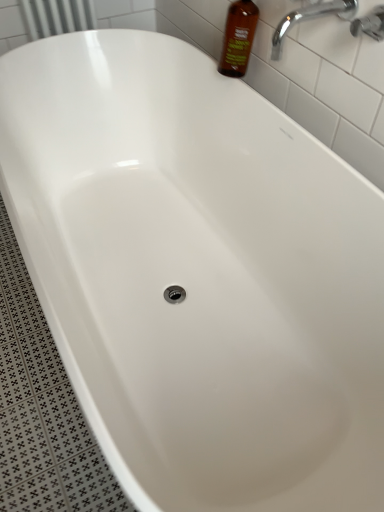
Identify the location of chrome metallic faucet at upper right. Image resolution: width=384 pixels, height=512 pixels. (370, 24).

The image size is (384, 512). Find the location of `chrome metallic faucet at upper right`. chrome metallic faucet at upper right is located at coordinates (370, 24).

Considering the relative positions of chrome metallic faucet at upper right and brown glass bottle at upper right in the image provided, is chrome metallic faucet at upper right to the left of brown glass bottle at upper right from the viewer's perspective?

No.

Measure the distance from chrome metallic faucet at upper right to brown glass bottle at upper right.

A distance of 15.78 inches exists between chrome metallic faucet at upper right and brown glass bottle at upper right.

Which point is more forward, (364, 24) or (245, 59)?

The point (364, 24) is closer.

From the image's perspective, who appears lower, chrome metallic faucet at upper right or brown glass bottle at upper right?

chrome metallic faucet at upper right.

Between point (243, 38) and point (376, 31), which one is positioned in front?

The point (376, 31) is more forward.

Where is `bottle that is above the chrome metallic faucet at upper right (from the image's perspective)`? Image resolution: width=384 pixels, height=512 pixels. bottle that is above the chrome metallic faucet at upper right (from the image's perspective) is located at coordinates (238, 38).

Is brown glass bottle at upper right oriented towards chrome metallic faucet at upper right?

No.

Based on the photo, is brown glass bottle at upper right not inside chrome metallic faucet at upper right?

Absolutely, brown glass bottle at upper right is external to chrome metallic faucet at upper right.

Who is taller, chrome metallic faucet at upper right or chrome metallic faucet at upper right?

With more height is chrome metallic faucet at upper right.

Considering the sizes of objects chrome metallic faucet at upper right and chrome metallic faucet at upper right in the image provided, who is thinner, chrome metallic faucet at upper right or chrome metallic faucet at upper right?

Thinner between the two is chrome metallic faucet at upper right.

Measure the distance from chrome metallic faucet at upper right to chrome metallic faucet at upper right.

chrome metallic faucet at upper right and chrome metallic faucet at upper right are 5.34 inches apart from each other.

Based on the photo, can we say chrome metallic faucet at upper right lies outside chrome metallic faucet at upper right?

chrome metallic faucet at upper right lies outside chrome metallic faucet at upper right's area.

Between brown glass bottle at upper right and chrome metallic faucet at upper right, which one has more height?

With more height is brown glass bottle at upper right.

From a real-world perspective, is brown glass bottle at upper right over chrome metallic faucet at upper right?

Actually, brown glass bottle at upper right is physically below chrome metallic faucet at upper right in the real world.

Considering the points (225, 67) and (355, 12), which point is in front, point (225, 67) or point (355, 12)?

Point (355, 12)

Looking at their sizes, would you say brown glass bottle at upper right is wider or thinner than chrome metallic faucet at upper right?

brown glass bottle at upper right is thinner than chrome metallic faucet at upper right.

What's the angular difference between chrome metallic faucet at upper right and chrome metallic faucet at upper right's facing directions?

chrome metallic faucet at upper right and chrome metallic faucet at upper right are facing 0.00544 degrees away from each other.

Which of these two, chrome metallic faucet at upper right or chrome metallic faucet at upper right, is smaller?

chrome metallic faucet at upper right is smaller.

Between chrome metallic faucet at upper right and chrome metallic faucet at upper right, which one has larger width?

Wider between the two is chrome metallic faucet at upper right.

Is chrome metallic faucet at upper right facing towards chrome metallic faucet at upper right?

No, chrome metallic faucet at upper right is not turned towards chrome metallic faucet at upper right.

From the image's perspective, does chrome metallic faucet at upper right appear higher than brown glass bottle at upper right?

Actually, chrome metallic faucet at upper right appears below brown glass bottle at upper right in the image.

From a real-world perspective, is chrome metallic faucet at upper right beneath brown glass bottle at upper right?

Incorrect, from a real-world perspective, chrome metallic faucet at upper right is higher than brown glass bottle at upper right.

Does chrome metallic faucet at upper right have a lesser width compared to brown glass bottle at upper right?

No, chrome metallic faucet at upper right is not thinner than brown glass bottle at upper right.

Considering the sizes of objects chrome metallic faucet at upper right and brown glass bottle at upper right in the image provided, who is smaller, chrome metallic faucet at upper right or brown glass bottle at upper right?

With smaller size is chrome metallic faucet at upper right.

Identify the location of bottle behind the chrome metallic faucet at upper right. (238, 38).

The image size is (384, 512). Identify the location of bottle above the chrome metallic faucet at upper right (from the image's perspective). (238, 38).

When comparing their distances from chrome metallic faucet at upper right, does chrome metallic faucet at upper right or brown glass bottle at upper right seem further?

Based on the image, brown glass bottle at upper right appears to be further to chrome metallic faucet at upper right.

Based on the photo, when comparing their distances from brown glass bottle at upper right, does chrome metallic faucet at upper right or chrome metallic faucet at upper right seem further?

chrome metallic faucet at upper right lies further to brown glass bottle at upper right than the other object.

Considering their positions, is chrome metallic faucet at upper right positioned closer to chrome metallic faucet at upper right than brown glass bottle at upper right?

Based on the image, chrome metallic faucet at upper right appears to be nearer to chrome metallic faucet at upper right.

Based on their spatial positions, is brown glass bottle at upper right or chrome metallic faucet at upper right further from chrome metallic faucet at upper right?

brown glass bottle at upper right lies further to chrome metallic faucet at upper right than the other object.

Looking at the image, which one is located closer to brown glass bottle at upper right, chrome metallic faucet at upper right or chrome metallic faucet at upper right?

Among the two, chrome metallic faucet at upper right is located nearer to brown glass bottle at upper right.

Based on their spatial positions, is brown glass bottle at upper right or chrome metallic faucet at upper right further from chrome metallic faucet at upper right?

Among the two, brown glass bottle at upper right is located further to chrome metallic faucet at upper right.

At what (x,y) coordinates should I click in order to perform the action: click on tap positioned between chrome metallic faucet at upper right and brown glass bottle at upper right from near to far. Please return your answer as a coordinate pair (x, y). Looking at the image, I should click on point(311,19).